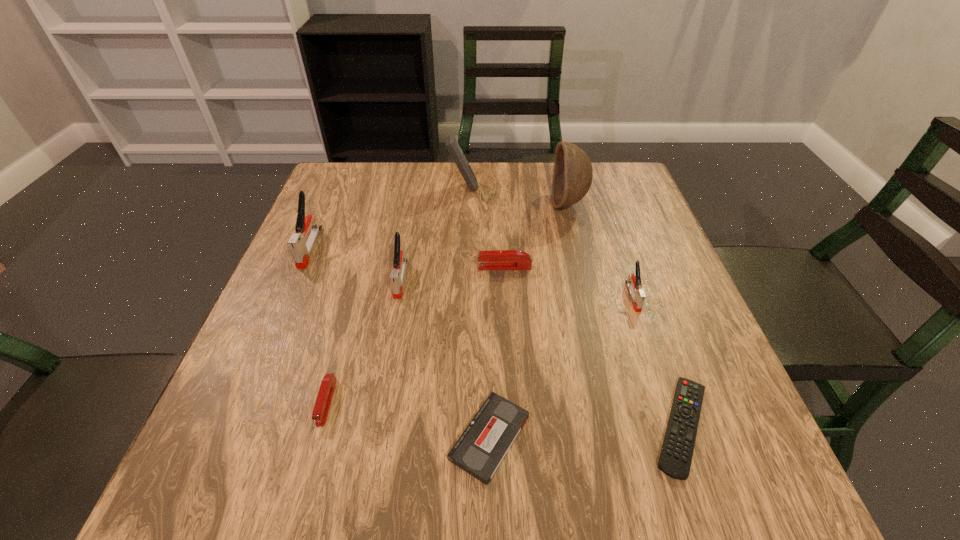
This screenshot has width=960, height=540. What are the coordinates of `the nearer red stapler` in the screenshot? It's located at (320, 412).

Locate an element on the screen. The image size is (960, 540). the shortest stapler is located at coordinates (320, 412).

Identify the location of videotape. coord(481,448).

Where is `the shortest object`? the shortest object is located at coordinates (675, 459).

I want to click on vacant region located 0.150m on the left of the bowl, so click(496, 204).

Where is `vacant space located 0.120m on the front-facing side of the blue calculator`? The height and width of the screenshot is (540, 960). vacant space located 0.120m on the front-facing side of the blue calculator is located at coordinates (521, 187).

You are a GUI agent. You are given a task and a screenshot of the screen. Output one action in this format:
    pyautogui.click(x=<x>, y=<y>)
    Task: Click on the vacant space located on the handle side of the leftmost gray stapler
    
    Given the screenshot: What is the action you would take?
    pyautogui.click(x=247, y=395)

Locate an element on the screen. vacant space located on the handle side of the sixth shortest object is located at coordinates (378, 402).

Identify the location of free space located 0.060m on the handle side of the third shortest stapler. The image size is (960, 540). (646, 335).

Locate an element on the screen. Image resolution: width=960 pixels, height=540 pixels. free spot located 0.350m on the front-facing side of the bigger red stapler is located at coordinates (323, 267).